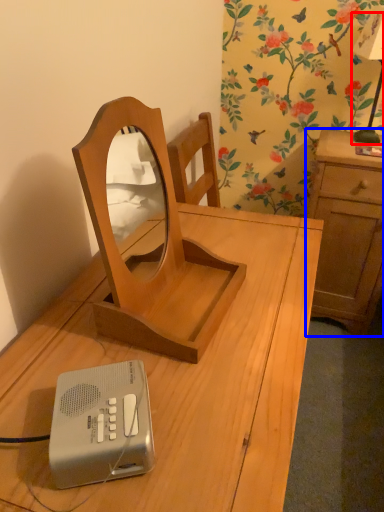
Question: Among these objects, which one is farthest to the camera, bedside lamp (highlighted by a red box) or cabinetry (highlighted by a blue box)?

Choices:
 (A) bedside lamp
 (B) cabinetry

Answer: (B)